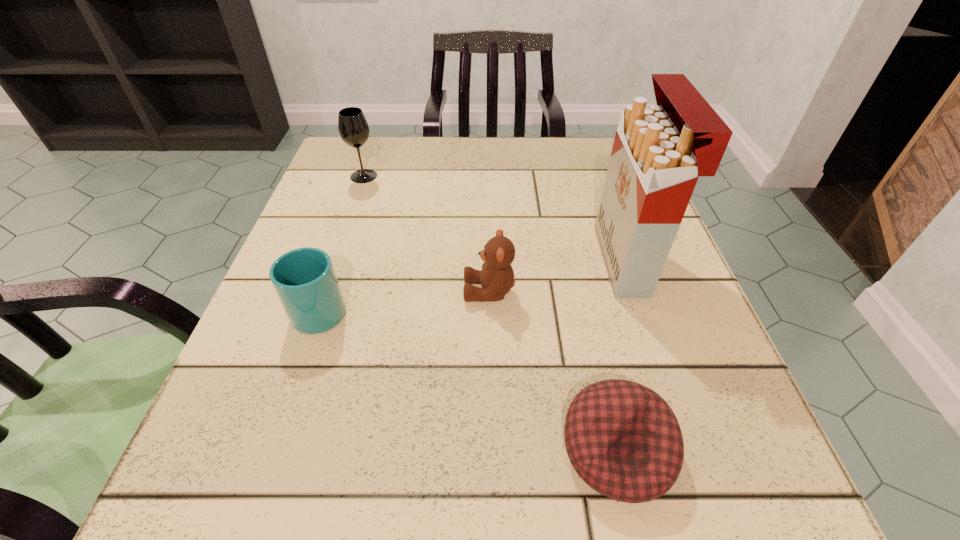
In the image, there is a desktop. What are the coordinates of `free space at the far right corner` in the screenshot? It's located at (565, 141).

You are a GUI agent. You are given a task and a screenshot of the screen. Output one action in this format:
    pyautogui.click(x=<x>, y=<y>)
    Task: Click on the free area in between the teddy bear and the cup
    Image resolution: width=960 pixels, height=540 pixels.
    Given the screenshot: What is the action you would take?
    pyautogui.click(x=405, y=300)

This screenshot has width=960, height=540. In order to click on empty location between the teddy bear and the tallest object in this screenshot , I will do `click(558, 276)`.

At what (x,y) coordinates should I click in order to perform the action: click on free space between the cup and the beanbag. Please return your answer as a coordinate pair (x, y). The image size is (960, 540). Looking at the image, I should click on (x=468, y=379).

Image resolution: width=960 pixels, height=540 pixels. Find the location of `blank region between the shortest object and the third object from left to right`. blank region between the shortest object and the third object from left to right is located at coordinates (553, 370).

At what (x,y) coordinates should I click in order to perform the action: click on free space that is in between the teddy bear and the wineglass. Please return your answer as a coordinate pair (x, y). The height and width of the screenshot is (540, 960). Looking at the image, I should click on (426, 234).

This screenshot has width=960, height=540. I want to click on free space that is in between the cup and the fourth shortest object, so click(x=343, y=242).

Identify the location of vacant space that's between the nearest object and the farthest object. This screenshot has height=540, width=960. (491, 313).

Find the location of a particular element. unoccupied position between the wineglass and the cigarette case is located at coordinates (494, 218).

You are a GUI agent. You are given a task and a screenshot of the screen. Output one action in this format:
    pyautogui.click(x=<x>, y=<y>)
    Task: Click on the free space between the nearest object and the cigarette case
    This screenshot has height=540, width=960.
    Given the screenshot: What is the action you would take?
    pyautogui.click(x=621, y=355)